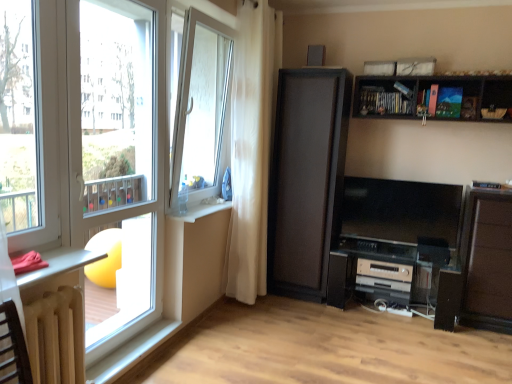
In order to click on brown wooden table at lower left, marked as the second table in a top-to-bottom arrangement in this screenshot , I will do `click(56, 336)`.

What is the approximate width of brown wooden table at lower left, the first table positioned from the bottom?

brown wooden table at lower left, the first table positioned from the bottom, is 6.23 inches wide.

The image size is (512, 384). What do you see at coordinates (487, 261) in the screenshot?
I see `matte black cabinet at lower right` at bounding box center [487, 261].

What do you see at coordinates (31, 122) in the screenshot?
I see `white plastic window at left, acting as the 2th window starting from the back` at bounding box center [31, 122].

The image size is (512, 384). I want to click on metallic silver table at lower left, positioned as the 1th table in top-to-bottom order, so click(58, 264).

Describe the element at coordinates (306, 179) in the screenshot. I see `black matte cabinet at center` at that location.

What is the approximate width of black plastic speaker at lower right, the 2th appliance when ordered from bottom to top?

The width of black plastic speaker at lower right, the 2th appliance when ordered from bottom to top, is 28.00 centimeters.

The image size is (512, 384). Find the location of `black plastic speaker at lower right, the 2th appliance when ordered from bottom to top`. black plastic speaker at lower right, the 2th appliance when ordered from bottom to top is located at coordinates (433, 250).

What is the approximate height of wooden dark brown shelf at upper right?

wooden dark brown shelf at upper right is 14.23 inches tall.

Where is `silver metallic stereo at lower center, the 2th appliance when ordered from top to bottom`? The width and height of the screenshot is (512, 384). silver metallic stereo at lower center, the 2th appliance when ordered from top to bottom is located at coordinates (386, 270).

From the picture: Considering the relative sizes of metallic silver table at lower left, positioned as the 1th table in top-to-bottom order, and black matte cabinet at center in the image provided, is metallic silver table at lower left, positioned as the 1th table in top-to-bottom order, bigger than black matte cabinet at center?

Incorrect, metallic silver table at lower left, positioned as the 1th table in top-to-bottom order, is not larger than black matte cabinet at center.

Looking at their sizes, would you say metallic silver table at lower left, positioned as the second table in bottom-to-top order, is wider or thinner than black matte cabinet at center?

Considering their sizes, metallic silver table at lower left, positioned as the second table in bottom-to-top order, looks slimmer than black matte cabinet at center.

From a real-world perspective, is metallic silver table at lower left, positioned as the second table in bottom-to-top order, physically above black matte cabinet at center?

No, from a real-world perspective, metallic silver table at lower left, positioned as the second table in bottom-to-top order, is not over black matte cabinet at center

From the image's perspective, would you say metallic silver table at lower left, positioned as the 1th table in top-to-bottom order, is shown under black matte cabinet at center?

Yes.

Considering the sizes of objects brown wooden table at lower left, the first table positioned from the bottom, and white plastic window frame at left in the image provided, who is wider, brown wooden table at lower left, the first table positioned from the bottom, or white plastic window frame at left?

With larger width is brown wooden table at lower left, the first table positioned from the bottom.

Which is more to the right, brown wooden table at lower left, marked as the second table in a top-to-bottom arrangement, or white plastic window frame at left?

Positioned to the right is white plastic window frame at left.

Is brown wooden table at lower left, marked as the second table in a top-to-bottom arrangement, smaller than white plastic window frame at left?

Yes.

Can you confirm if matte black cabinet at lower right is shorter than white glass window at center, marked as the first window in a back-to-front arrangement?

Yes, matte black cabinet at lower right is shorter than white glass window at center, marked as the first window in a back-to-front arrangement.

Is point (505, 321) less distant than point (198, 82)?

Yes.

Can you confirm if matte black cabinet at lower right is thinner than white glass window at center, marked as the first window in a back-to-front arrangement?

No, matte black cabinet at lower right is not thinner than white glass window at center, marked as the first window in a back-to-front arrangement.

Considering the relative positions of matte black cabinet at lower right and white glass window at center, marked as the first window in a back-to-front arrangement, in the image provided, is matte black cabinet at lower right behind white glass window at center, marked as the first window in a back-to-front arrangement,?

Yes.

At what (x,y) coordinates should I click in order to perform the action: click on window located below the white glass window at center, which appears as the second window when viewed from the left (from the image's perspective). Please return your answer as a coordinate pair (x, y). The image size is (512, 384). Looking at the image, I should click on (31, 122).

Is white plastic window at left, the 2th window when ordered from right to left, to the left of white glass window at center, marked as the first window in a back-to-front arrangement, from the viewer's perspective?

Indeed, white plastic window at left, the 2th window when ordered from right to left, is positioned on the left side of white glass window at center, marked as the first window in a back-to-front arrangement.

From the picture: Can you see white plastic window at left, the first window in the left-to-right sequence, touching white glass window at center, the 1th window when ordered from right to left?

No, white plastic window at left, the first window in the left-to-right sequence, is not with white glass window at center, the 1th window when ordered from right to left.

Can you tell me how much white plastic window at left, the 2th window when ordered from right to left, and white glass window at center, which appears as the second window when viewed from the left, differ in facing direction?

The angle between the facing direction of white plastic window at left, the 2th window when ordered from right to left, and the facing direction of white glass window at center, which appears as the second window when viewed from the left, is 0.162 degrees.

Does white plastic window sill at lower left have a lesser width compared to white sheer curtain at center?

Yes.

Is white plastic window sill at lower left with white sheer curtain at center?

No, white plastic window sill at lower left is not in contact with white sheer curtain at center.

Is white plastic window sill at lower left bigger or smaller than white sheer curtain at center?

white plastic window sill at lower left is smaller than white sheer curtain at center.

From a real-world perspective, is white plastic window sill at lower left located higher than white sheer curtain at center?

Actually, white plastic window sill at lower left is physically below white sheer curtain at center in the real world.

Is silver metallic stereo at lower center, which ranks as the first appliance in bottom-to-top order, oriented away from matte black cabinet at lower right?

silver metallic stereo at lower center, which ranks as the first appliance in bottom-to-top order, is not turned away from matte black cabinet at lower right.

Considering the sizes of objects silver metallic stereo at lower center, which ranks as the first appliance in bottom-to-top order, and matte black cabinet at lower right in the image provided, who is wider, silver metallic stereo at lower center, which ranks as the first appliance in bottom-to-top order, or matte black cabinet at lower right?

silver metallic stereo at lower center, which ranks as the first appliance in bottom-to-top order.

Where is `cabinetry located above the silver metallic stereo at lower center, which ranks as the first appliance in bottom-to-top order (from a real-world perspective)`? The width and height of the screenshot is (512, 384). cabinetry located above the silver metallic stereo at lower center, which ranks as the first appliance in bottom-to-top order (from a real-world perspective) is located at coordinates (487, 261).

Which is nearer, [466,315] or [66,305]?

Point [466,315] is positioned farther from the camera compared to point [66,305].

Is matte black cabinet at lower right situated inside brown wooden table at lower left, marked as the second table in a top-to-bottom arrangement, or outside?

matte black cabinet at lower right is located beyond the bounds of brown wooden table at lower left, marked as the second table in a top-to-bottom arrangement.

Considering the sizes of objects matte black cabinet at lower right and brown wooden table at lower left, the first table positioned from the bottom, in the image provided, who is shorter, matte black cabinet at lower right or brown wooden table at lower left, the first table positioned from the bottom,?

With less height is brown wooden table at lower left, the first table positioned from the bottom.

Is matte black cabinet at lower right at the left side of brown wooden table at lower left, marked as the second table in a top-to-bottom arrangement?

Incorrect, matte black cabinet at lower right is not on the left side of brown wooden table at lower left, marked as the second table in a top-to-bottom arrangement.

This screenshot has height=384, width=512. I want to click on cupboard above the metallic silver table at lower left, positioned as the second table in bottom-to-top order (from the image's perspective), so (306, 179).

Where is `the 2nd table below the white plastic window frame at left (from the image's perspective)`? The height and width of the screenshot is (384, 512). the 2nd table below the white plastic window frame at left (from the image's perspective) is located at coordinates (56, 336).

Looking at the image, which one is located closer to matte black cabinet at lower right, white sheer curtain at center or white glass window at center, the 1th window when ordered from right to left?

Based on the image, white sheer curtain at center appears to be nearer to matte black cabinet at lower right.

When comparing their distances from white plastic window sill at lower left, does white plastic window at left, the first window in the left-to-right sequence, or white glass window at center, which appears as the second window when viewed from the left, seem further?

white plastic window at left, the first window in the left-to-right sequence, lies further to white plastic window sill at lower left than the other object.

When comparing their distances from matte black cabinet at lower right, does white plastic window sill at lower left or white plastic window frame at left seem further?

white plastic window frame at left is further to matte black cabinet at lower right.

Based on their spatial positions, is wooden dark brown shelf at upper right or white glass window at center, marked as the first window in a back-to-front arrangement, closer to white plastic window at left, acting as the 2th window starting from the back?

Based on the image, white glass window at center, marked as the first window in a back-to-front arrangement, appears to be nearer to white plastic window at left, acting as the 2th window starting from the back.

Considering their positions, is black matte cabinet at center positioned closer to black plastic speaker at lower right, the first appliance viewed from the top, than white glass window at center, the 2th window from the front?

black matte cabinet at center.

From the image, which object appears to be nearer to white plastic window sill at lower left, white glass window at center, which appears as the second window when viewed from the left, or white sheer curtain at center?

white sheer curtain at center lies closer to white plastic window sill at lower left than the other object.

From the image, which object appears to be nearer to black plastic speaker at lower right, the first appliance viewed from the top, white plastic window at left, the 2th window when ordered from right to left, or white plastic window frame at left?

white plastic window frame at left.

From the image, which object appears to be farther from white plastic window frame at left, white plastic window at left, the first window in the left-to-right sequence, or white plastic window sill at lower left?

Among the two, white plastic window sill at lower left is located further to white plastic window frame at left.

The height and width of the screenshot is (384, 512). What are the coordinates of `window frame between metallic silver table at lower left, positioned as the 1th table in top-to-bottom order, and black matte cabinet at center in the front-back direction` in the screenshot? It's located at (116, 152).

Locate an element on the screen. The image size is (512, 384). window sill between white glass window at center, the 2th window from the front, and black matte cabinet at center is located at coordinates (201, 211).

At what (x,y) coordinates should I click in order to perform the action: click on appliance between black matte cabinet at center and black plastic speaker at lower right, the first appliance viewed from the top, from left to right. Please return your answer as a coordinate pair (x, y). Looking at the image, I should click on (386, 270).

Where is `shelf between black matte cabinet at center and matte black cabinet at lower right in the horizontal direction`? shelf between black matte cabinet at center and matte black cabinet at lower right in the horizontal direction is located at coordinates (429, 97).